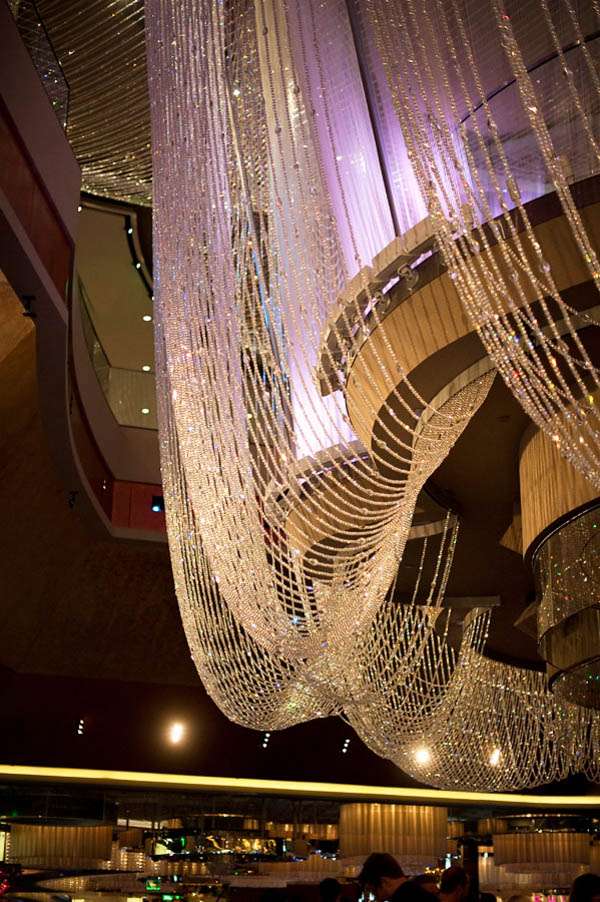
In order to click on ceiling in this screenshot , I will do pos(64,606).